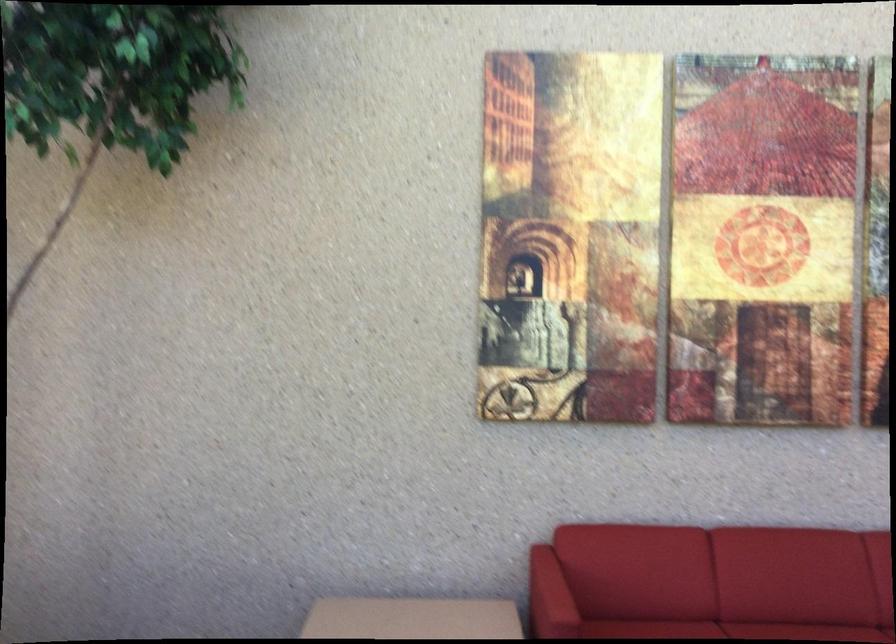
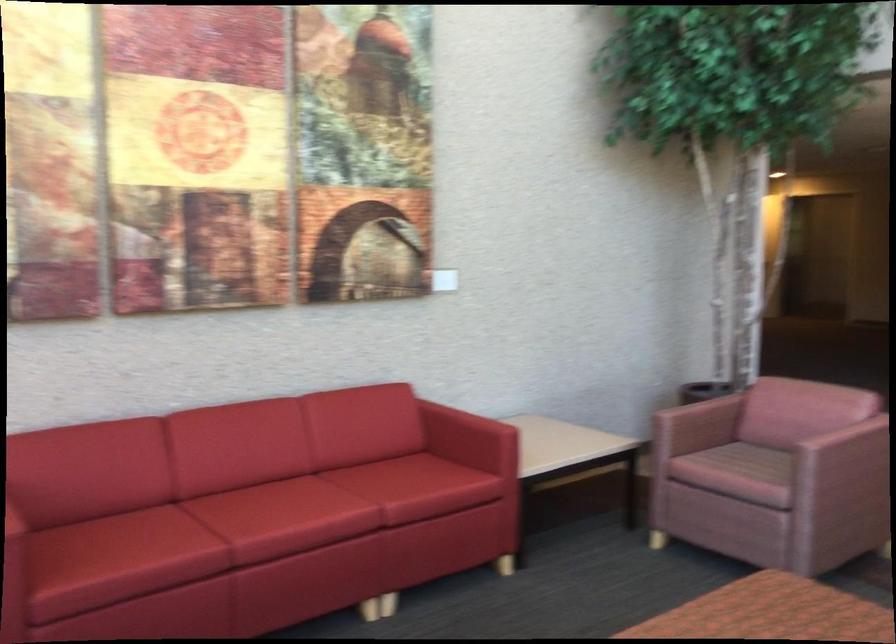
Question: Based on the continuous images, in which direction is the camera rotating? Reply with the corresponding letter.

Choices:
 (A) Left
 (B) Right
 (C) Up
 (D) Down

Answer: (B)